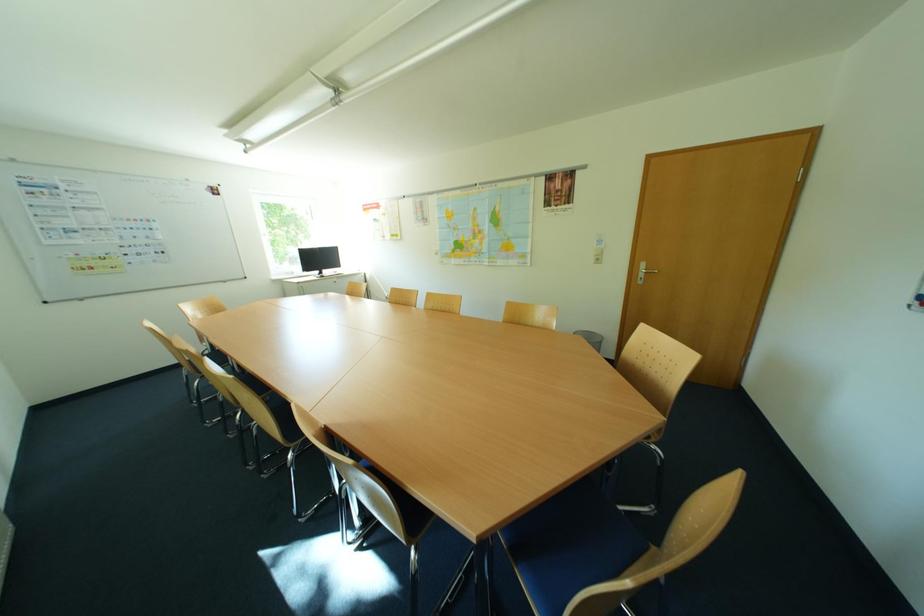
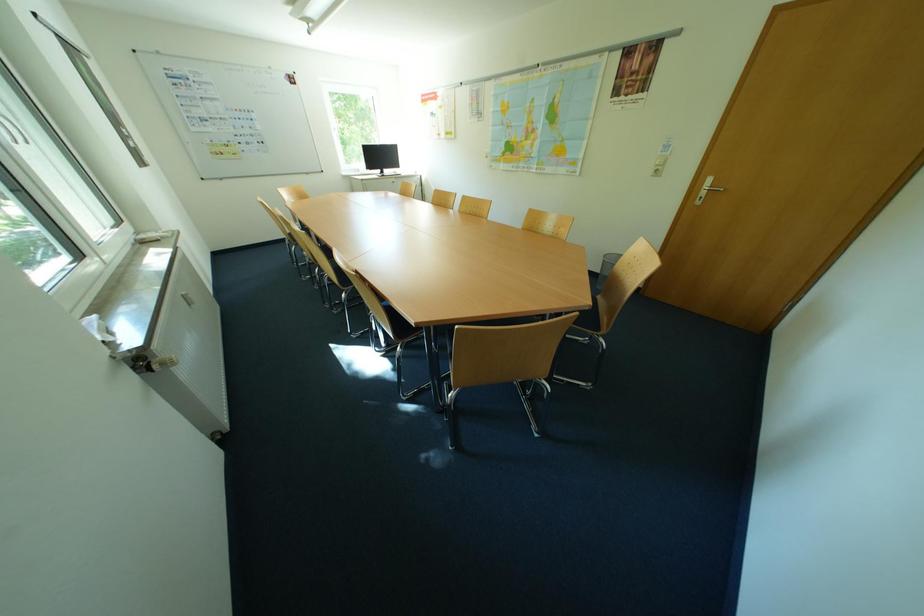
Question: Based on the continuous images, in which direction is the camera rotating? Reply with the corresponding letter.

Choices:
 (A) Left
 (B) Right
 (C) Up
 (D) Down

Answer: (D)